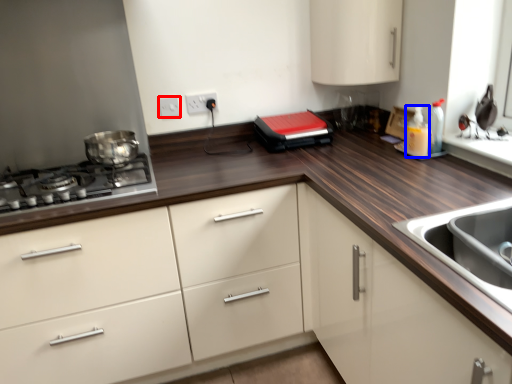
Question: Which of the following is the closest to the observer, electric outlet (highlighted by a red box) or bottle (highlighted by a blue box)?

Choices:
 (A) electric outlet
 (B) bottle

Answer: (B)